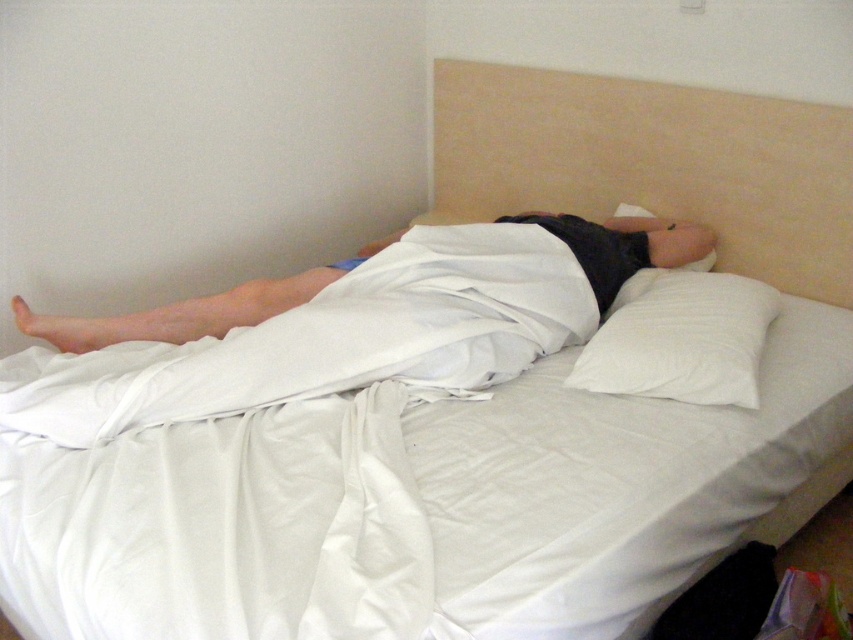
Question: Can you confirm if beige fabric headboard at upper center is bigger than smooth white towel at lower left?

Choices:
 (A) no
 (B) yes

Answer: (B)

Question: Is beige fabric headboard at upper center to the right of white soft pillow at upper right from the viewer's perspective?

Choices:
 (A) no
 (B) yes

Answer: (A)

Question: Among these objects, which one is farthest from the camera?

Choices:
 (A) beige fabric headboard at upper center
 (B) smooth white towel at lower left
 (C) white soft pillow at upper right

Answer: (B)

Question: Observing the image, what is the correct spatial positioning of white soft pillow at upper right in reference to smooth white towel at lower left?

Choices:
 (A) left
 (B) right

Answer: (B)

Question: Which of the following is the closest to the observer?

Choices:
 (A) (741, 400)
 (B) (584, 260)
 (C) (636, 172)

Answer: (A)

Question: Which point appears farthest from the camera in this image?

Choices:
 (A) (817, 230)
 (B) (152, 339)

Answer: (A)